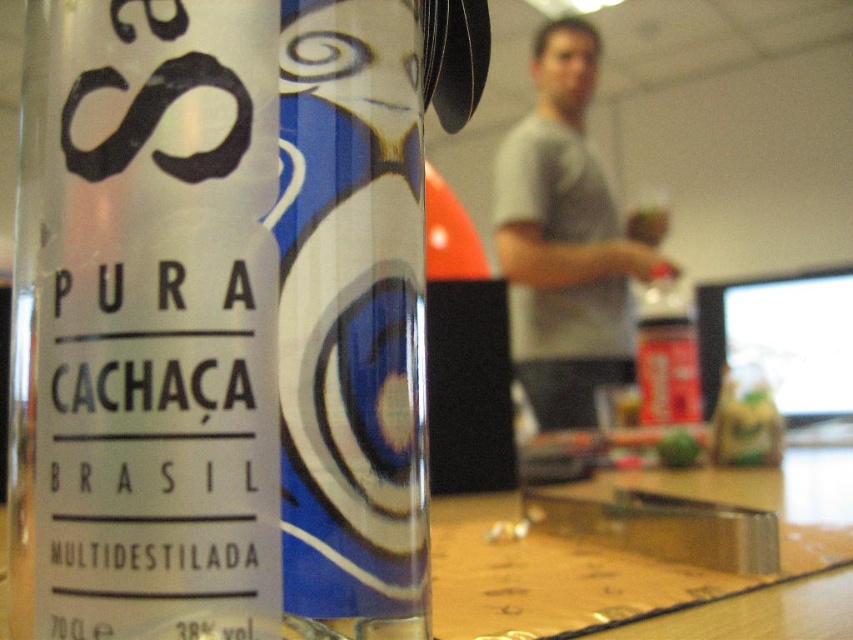
Identify the location of clear glass bottle at center. (225, 314).

Who is higher up, clear glass bottle at center or gray cotton shirt at upper center?

gray cotton shirt at upper center is higher up.

Is point (379, 570) positioned after point (665, 230)?

No, it is not.

Where is `clear glass bottle at center`? The image size is (853, 640). clear glass bottle at center is located at coordinates (225, 314).